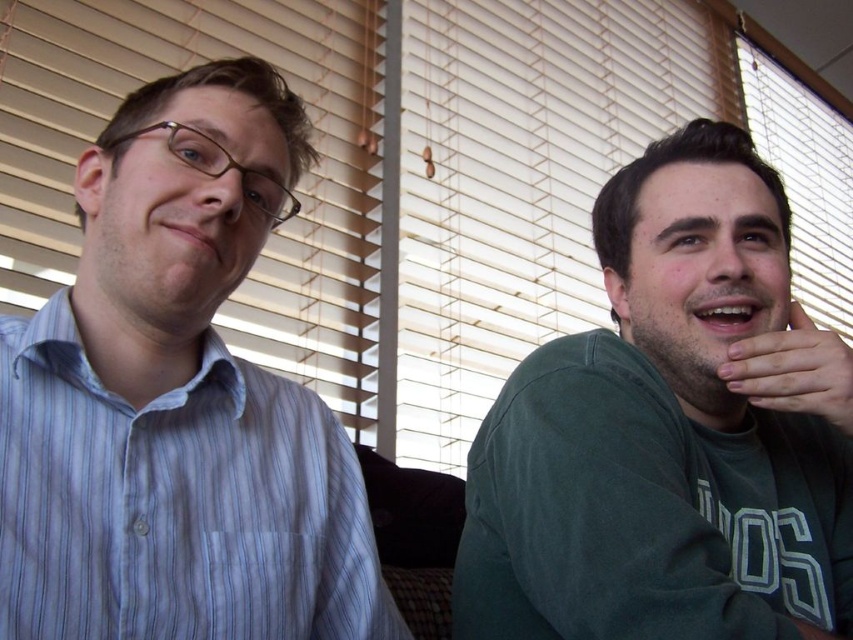
Is green matte shirt at right below matte wood blinds at center?

Correct, green matte shirt at right is located below matte wood blinds at center.

Does green matte shirt at right have a lesser height compared to matte wood blinds at center?

Correct, green matte shirt at right is not as tall as matte wood blinds at center.

Is point (843, 637) farther from viewer compared to point (447, 316)?

No, it is in front of (447, 316).

Locate an element on the screen. The height and width of the screenshot is (640, 853). green matte shirt at right is located at coordinates (671, 432).

Is green matte shirt at right to the right of blue striped shirt at left from the viewer's perspective?

Correct, you'll find green matte shirt at right to the right of blue striped shirt at left.

Does green matte shirt at right have a larger size compared to blue striped shirt at left?

Yes, green matte shirt at right is bigger than blue striped shirt at left.

From the picture: Who is more distant from viewer, [622,380] or [297,588]?

The point [622,380] is behind.

You are a GUI agent. You are given a task and a screenshot of the screen. Output one action in this format:
    pyautogui.click(x=<x>, y=<y>)
    Task: Click on the green matte shirt at right
    Image resolution: width=853 pixels, height=640 pixels.
    Given the screenshot: What is the action you would take?
    pyautogui.click(x=671, y=432)

From the picture: Is matte wood blinds at center to the right of matte striped shirt at left from the viewer's perspective?

Yes, matte wood blinds at center is to the right of matte striped shirt at left.

Does matte wood blinds at center come behind matte striped shirt at left?

Yes, matte wood blinds at center is behind matte striped shirt at left.

You are a GUI agent. You are given a task and a screenshot of the screen. Output one action in this format:
    pyautogui.click(x=<x>, y=<y>)
    Task: Click on the matte wood blinds at center
    Image resolution: width=853 pixels, height=640 pixels.
    Given the screenshot: What is the action you would take?
    pyautogui.click(x=517, y=182)